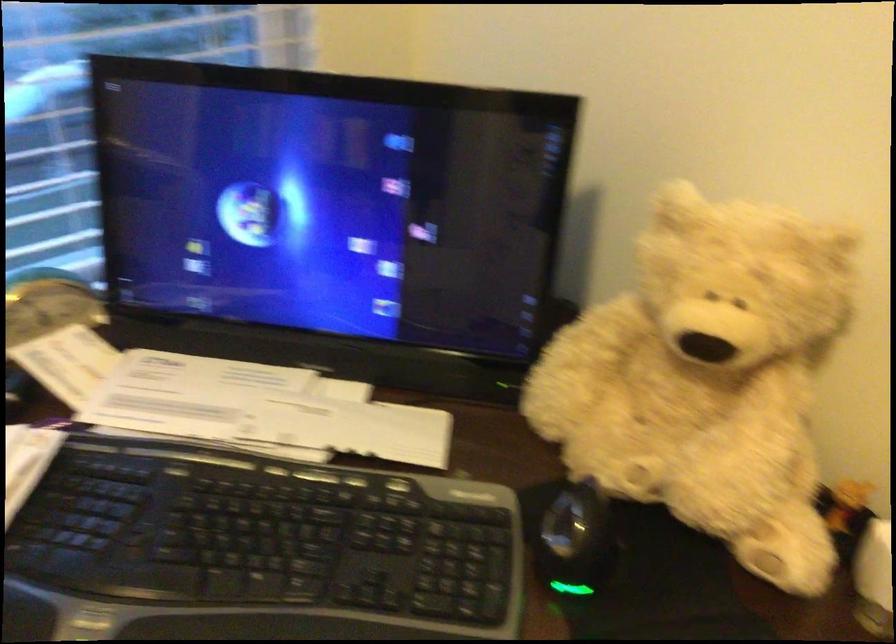
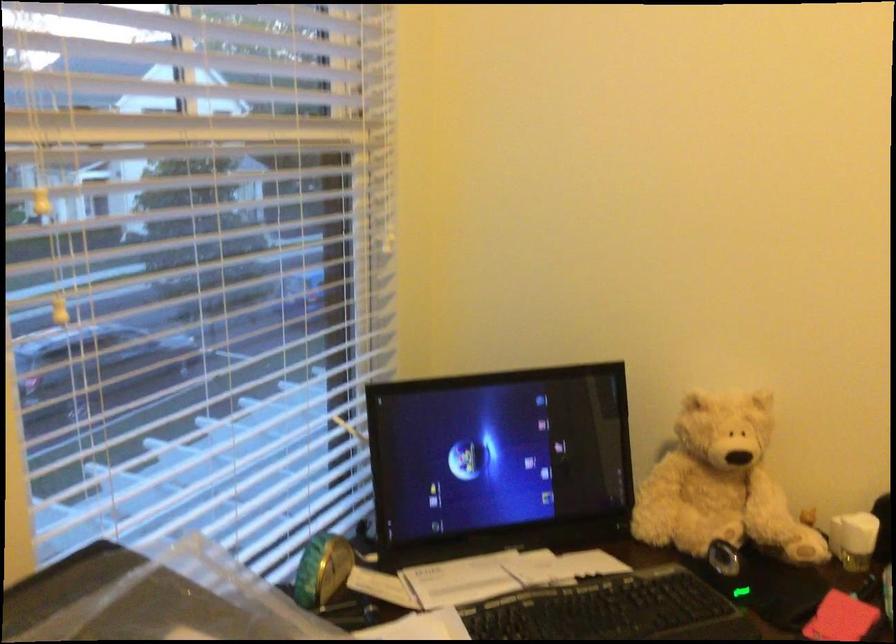
Question: I am providing you with two images of the same scene from different viewpoints. After the viewpoint changes to image2, which objects are now occluded?

Choices:
 (A) light brown teddy bear
 (B) pink rectangular object
 (C) small green clock
 (D) none of these

Answer: (D)